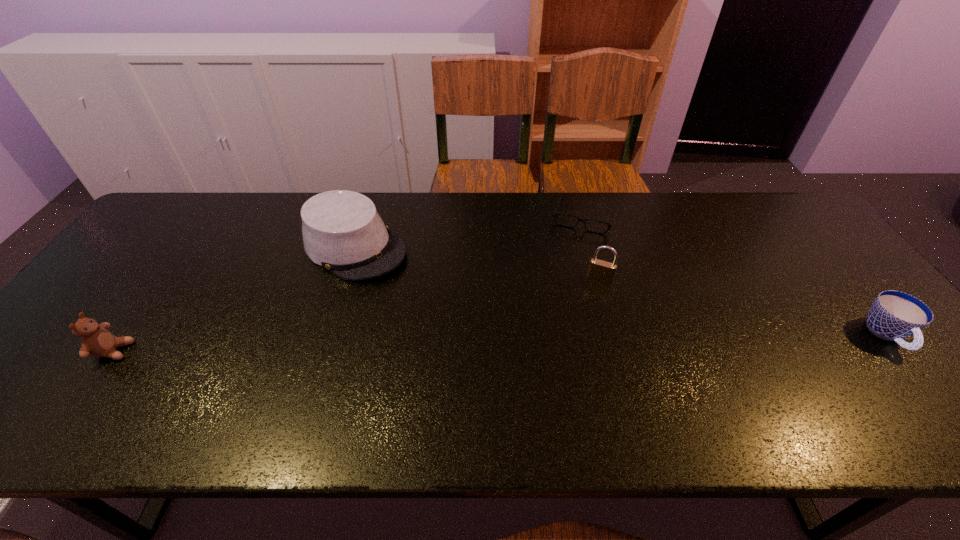
The image size is (960, 540). Identify the location of free space between the cup and the padlock. (743, 307).

Locate an element on the screen. The image size is (960, 540). free space between the teddy bear and the padlock is located at coordinates (357, 315).

You are a GUI agent. You are given a task and a screenshot of the screen. Output one action in this format:
    pyautogui.click(x=<x>, y=<y>)
    Task: Click on the free space between the spectacles and the leftmost object
    This screenshot has width=960, height=540.
    Given the screenshot: What is the action you would take?
    pyautogui.click(x=349, y=283)

Identify the location of vacant space in between the hat and the leftmost object. (234, 299).

In order to click on free area in between the second object from left to right and the teddy bear in this screenshot , I will do `click(234, 299)`.

In order to click on empty location between the spectacles and the second shortest object in this screenshot , I will do `click(736, 275)`.

Find the location of a particular element. Image resolution: width=960 pixels, height=540 pixels. vacant point located between the teddy bear and the shortest object is located at coordinates (349, 283).

Locate an element on the screen. the closest object to the cup is located at coordinates (555, 214).

Locate an element on the screen. The image size is (960, 540). object that is the second closest to the rightmost object is located at coordinates point(599,270).

Where is `free space that satisfies the following two spatial constraints: 1. on the front side of the second object from left to right; 2. on the left side of the padlock`? This screenshot has width=960, height=540. free space that satisfies the following two spatial constraints: 1. on the front side of the second object from left to right; 2. on the left side of the padlock is located at coordinates (346, 279).